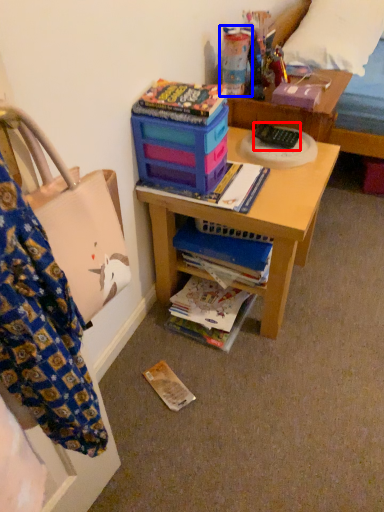
Question: Which object is closer to the camera taking this photo, remote control (highlighted by a red box) or toy (highlighted by a blue box)?

Choices:
 (A) remote control
 (B) toy

Answer: (B)